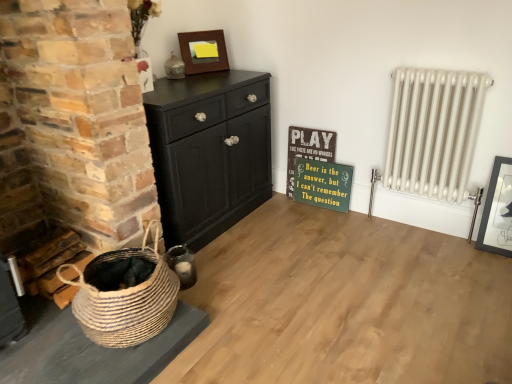
In order to click on free space in front of black painted wood chest of drawers at left in this screenshot , I will do `click(251, 274)`.